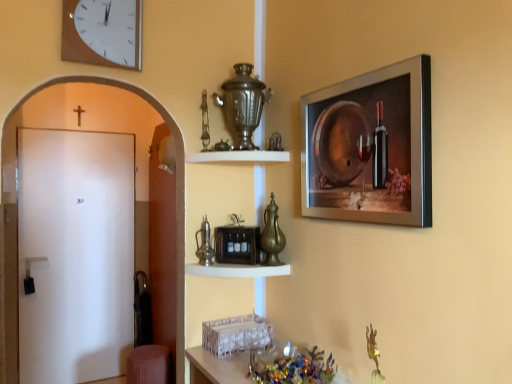
Locate an element on the screen. Image resolution: width=512 pixels, height=384 pixels. vacant space situated above silver metallic picture frame at upper right (from a real-world perspective) is located at coordinates (354, 78).